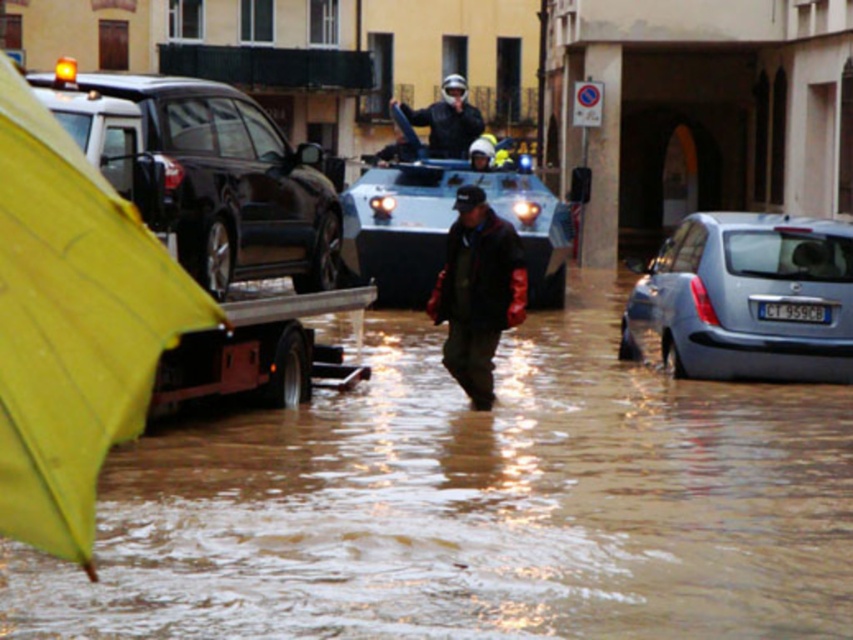
Question: In this image, where is shiny black suv at left located relative to dark brown leather jacket at center?

Choices:
 (A) below
 (B) above

Answer: (B)

Question: Which object is the farthest from the shiny black suv at left?

Choices:
 (A) dark brown leather jacket at center
 (B) yellow fabric umbrella at left
 (C) brown muddy water at lower center
 (D) silver metallic car at lower right

Answer: (B)

Question: Which object appears farthest from the camera in this image?

Choices:
 (A) shiny black suv at left
 (B) yellow fabric umbrella at left

Answer: (A)

Question: Can you confirm if brown muddy water at lower center is wider than dark brown leather jacket at center?

Choices:
 (A) no
 (B) yes

Answer: (B)

Question: Is the position of brown muddy water at lower center less distant than that of yellow fabric umbrella at left?

Choices:
 (A) yes
 (B) no

Answer: (B)

Question: Which point is farther to the camera?

Choices:
 (A) (463, 268)
 (B) (18, 579)
 (C) (149, 104)
 (D) (453, 120)

Answer: (D)